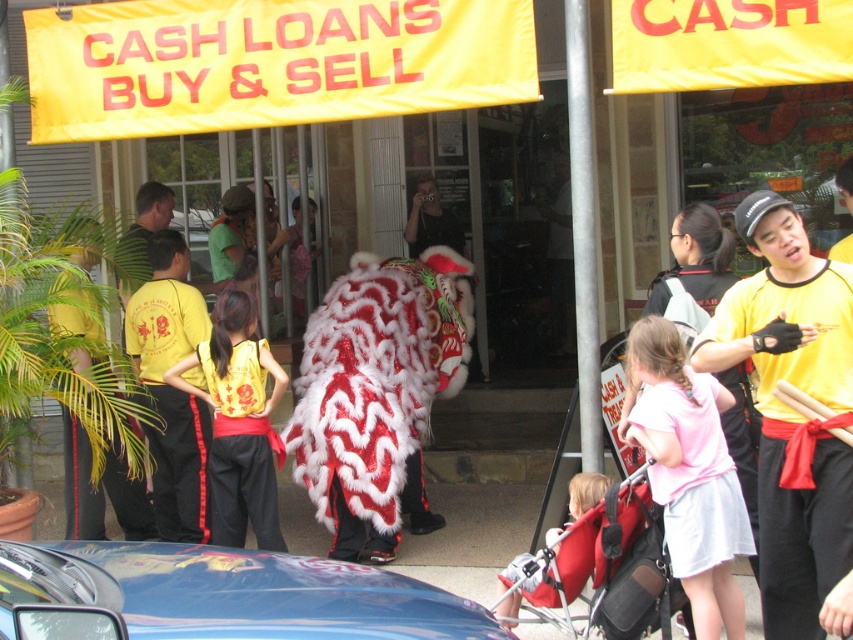
Question: Does yellow fabric banner at upper center appear on the left side of red fabric stroller at lower center?

Choices:
 (A) yes
 (B) no

Answer: (A)

Question: Which point appears closest to the camera in this image?

Choices:
 (A) (323, 10)
 (B) (65, 588)

Answer: (B)

Question: Which point is closer to the camera?

Choices:
 (A) shiny blue car at center
 (B) yellow fabric pants at left

Answer: (A)

Question: Observing the image, what is the correct spatial positioning of yellow fabric banner at upper center in reference to pink fabric dress at center?

Choices:
 (A) right
 (B) left

Answer: (B)

Question: Considering the relative positions of pink fabric dress at center and red fabric stroller at lower center in the image provided, where is pink fabric dress at center located with respect to red fabric stroller at lower center?

Choices:
 (A) right
 (B) left

Answer: (A)

Question: Which of these objects is positioned farthest from the pink fabric dress at center?

Choices:
 (A) yellow fabric pants at left
 (B) black satin vest at center

Answer: (A)